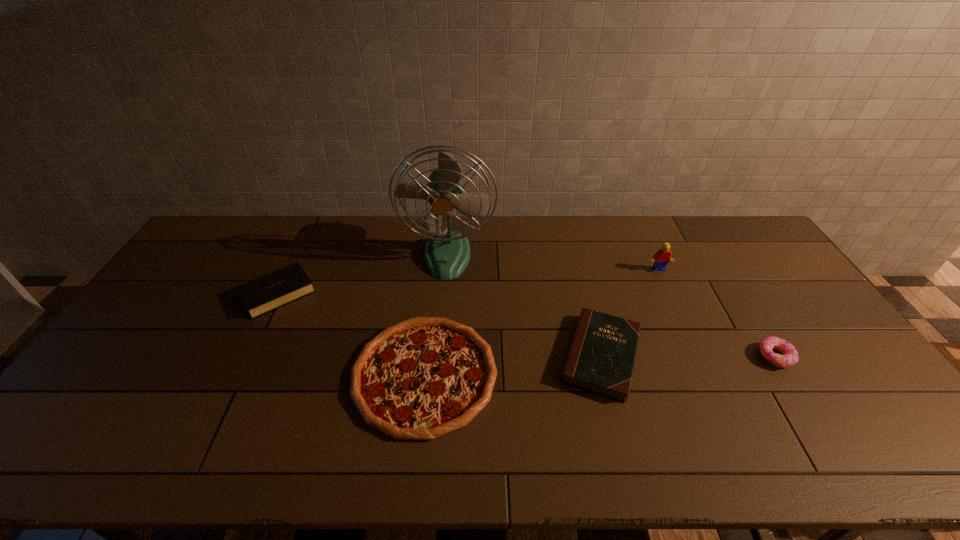
What are the coordinates of `the tallest object` in the screenshot? It's located at (447, 253).

Locate an element on the screen. The height and width of the screenshot is (540, 960). Lego is located at coordinates (661, 257).

This screenshot has width=960, height=540. I want to click on the second object from right to left, so point(661,257).

Locate an element on the screen. This screenshot has width=960, height=540. the left Bible is located at coordinates (271, 291).

This screenshot has height=540, width=960. Identify the location of the fourth object from left to right. (601, 357).

At what (x,y) coordinates should I click in order to perform the action: click on the rightmost object. Please return your answer as a coordinate pair (x, y). Image resolution: width=960 pixels, height=540 pixels. Looking at the image, I should click on pos(790,356).

Locate an element on the screen. pizza is located at coordinates (419, 379).

The height and width of the screenshot is (540, 960). In order to click on vacant space located 0.310m in front of the fan, directing airflow in this screenshot , I will do `click(439, 355)`.

Find the location of a particular element. blank space located 0.340m on the front-facing side of the Lego is located at coordinates pos(696,355).

At what (x,y) coordinates should I click in order to perform the action: click on blank space located 0.110m on the right of the left Bible. Please return your answer as a coordinate pair (x, y). The height and width of the screenshot is (540, 960). Looking at the image, I should click on (349, 294).